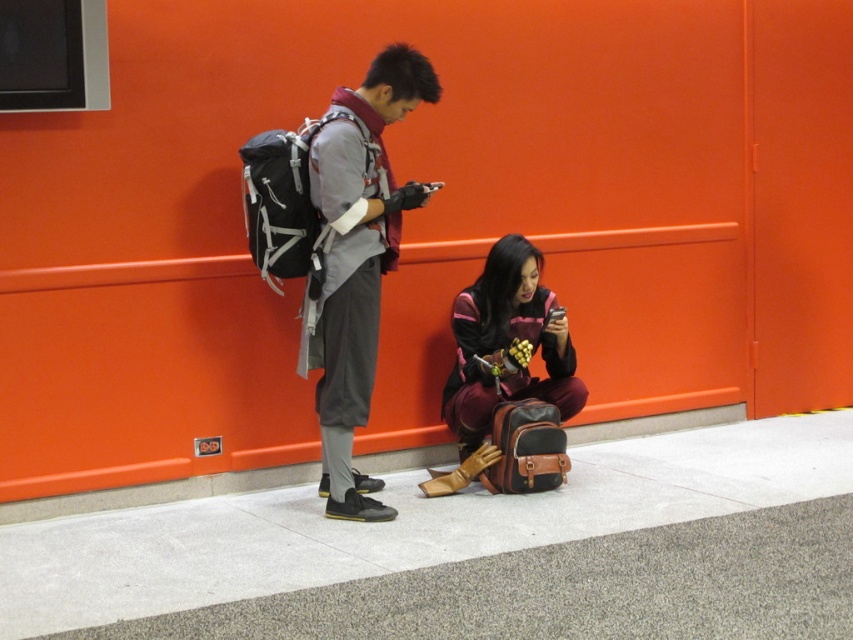
Between matte gray backpack at left and concrete curb at lower center, which one is positioned higher?

matte gray backpack at left is higher up.

Does point (360, 275) lie behind point (578, 435)?

No, it is not.

Find the location of a particular element. The height and width of the screenshot is (640, 853). matte gray backpack at left is located at coordinates (358, 260).

Can you confirm if gray concrete pavement at lower center is taller than concrete curb at lower center?

Yes.

Between point (776, 429) and point (428, 461), which one is positioned in front?

Positioned in front is point (428, 461).

You are a GUI agent. You are given a task and a screenshot of the screen. Output one action in this format:
    pyautogui.click(x=<x>, y=<y>)
    Task: Click on the gray concrete pavement at lower center
    
    Given the screenshot: What is the action you would take?
    pyautogui.click(x=476, y=552)

Between gray concrete pavement at lower center and maroon leather jacket at lower center, which one is positioned lower?

gray concrete pavement at lower center is below.

Find the location of a particular element. This screenshot has width=853, height=640. gray concrete pavement at lower center is located at coordinates (476, 552).

You are a GUI agent. You are given a task and a screenshot of the screen. Output one action in this format:
    pyautogui.click(x=<x>, y=<y>)
    Task: Click on the gray concrete pavement at lower center
    
    Given the screenshot: What is the action you would take?
    pyautogui.click(x=476, y=552)